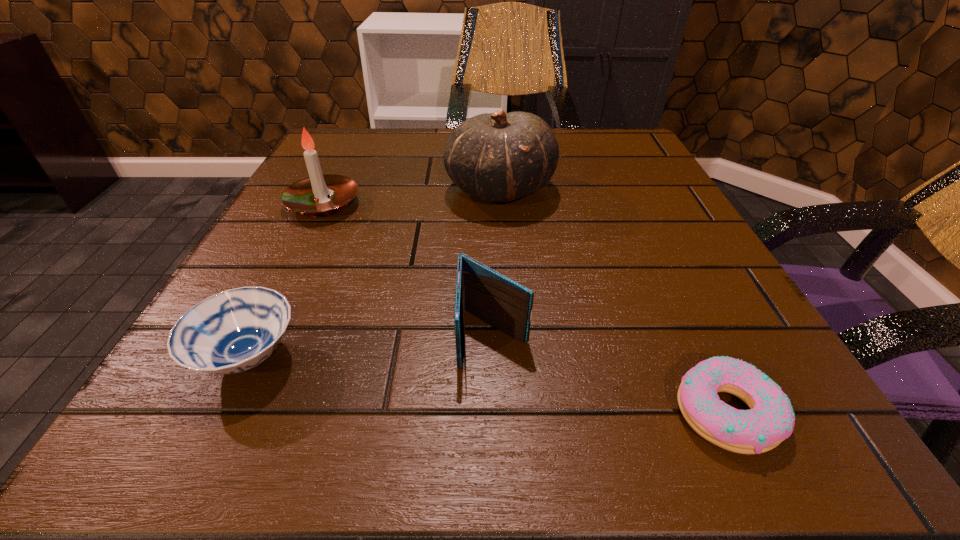
I want to click on unoccupied position between the soup bowl and the gourd, so click(x=374, y=273).

Where is `vacant space that is in between the gourd and the wallet`? This screenshot has width=960, height=540. vacant space that is in between the gourd and the wallet is located at coordinates (496, 263).

The height and width of the screenshot is (540, 960). Identify the location of free area in between the third shortest object and the rightmost object. (x=610, y=374).

Choose which object is the nearest neighbor to the wallet. Please provide its 2D coordinates. Your answer should be formatted as a tuple, i.e. [(x, y)], where the tuple contains the x and y coordinates of a point satisfying the conditions above.

[(770, 420)]

Find the location of a particular element. The image size is (960, 540). the closest object to the third tallest object is located at coordinates coord(770,420).

Identify the location of vacant position in the image that satisfies the following two spatial constraints: 1. on the exterior surface of the wallet; 2. on the left side of the doughnut. This screenshot has height=540, width=960. (495, 412).